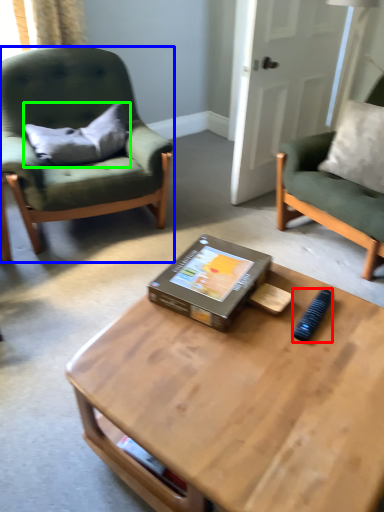
Question: Estimate the real-world distances between objects in this image. Which object is farther from remote control (highlighted by a red box), chair (highlighted by a blue box) or pillow (highlighted by a green box)?

Choices:
 (A) chair
 (B) pillow

Answer: (B)